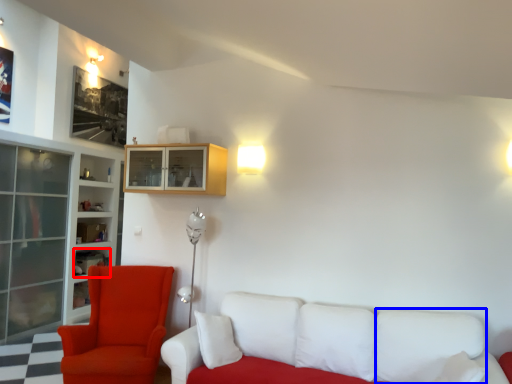
Question: Among these objects, which one is nearest to the camera, shelf (highlighted by a red box) or pillow (highlighted by a blue box)?

Choices:
 (A) shelf
 (B) pillow

Answer: (B)